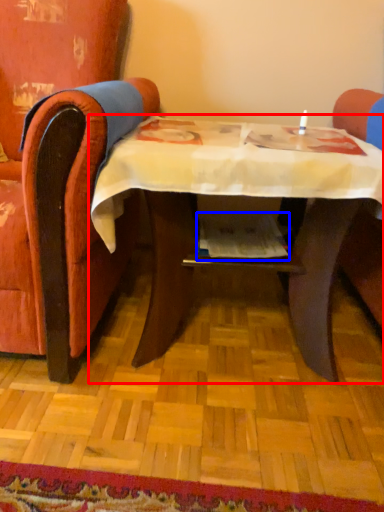
Question: Which of the following is the farthest to the observer, table (highlighted by a red box) or magazine (highlighted by a blue box)?

Choices:
 (A) table
 (B) magazine

Answer: (B)